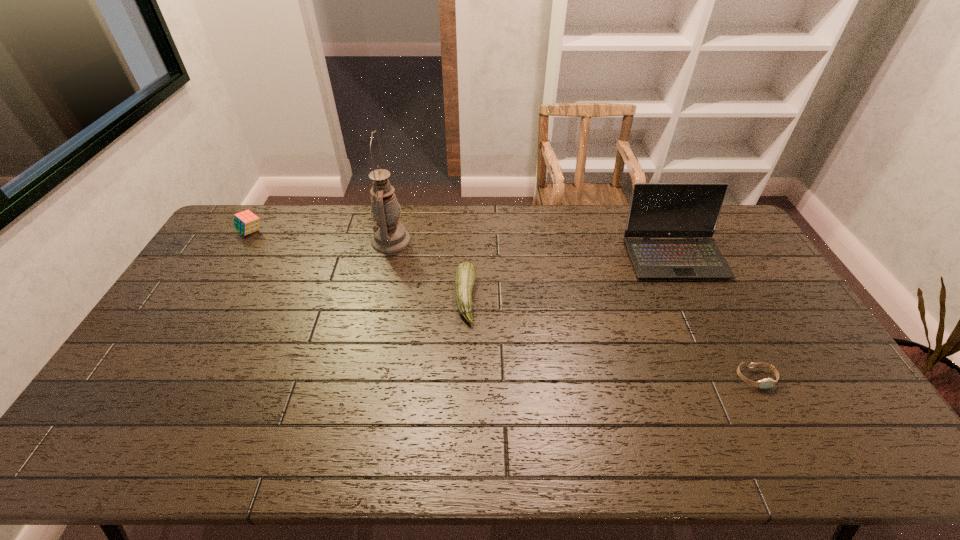
The height and width of the screenshot is (540, 960). In order to click on the second object from left to right in this screenshot , I will do `click(389, 236)`.

Find the location of a particular element. oil lamp is located at coordinates (389, 236).

Locate an element on the screen. The height and width of the screenshot is (540, 960). the second tallest object is located at coordinates (657, 210).

The width and height of the screenshot is (960, 540). Find the location of `cube`. cube is located at coordinates (246, 222).

At what (x,y) coordinates should I click in order to perform the action: click on the leftmost object. Please return your answer as a coordinate pair (x, y). The width and height of the screenshot is (960, 540). Looking at the image, I should click on (246, 222).

Where is `the second shortest object`? the second shortest object is located at coordinates (465, 275).

This screenshot has width=960, height=540. What are the coordinates of `the third object from right to left` in the screenshot? It's located at (465, 275).

Where is `the shortest object`? The width and height of the screenshot is (960, 540). the shortest object is located at coordinates [x=768, y=382].

At what (x,y) coordinates should I click in order to perform the action: click on the nearest object. Please return your answer as a coordinate pair (x, y). The height and width of the screenshot is (540, 960). Looking at the image, I should click on (768, 382).

Find the location of a particular element. The image size is (960, 540). free space located on the right of the oil lamp is located at coordinates (466, 241).